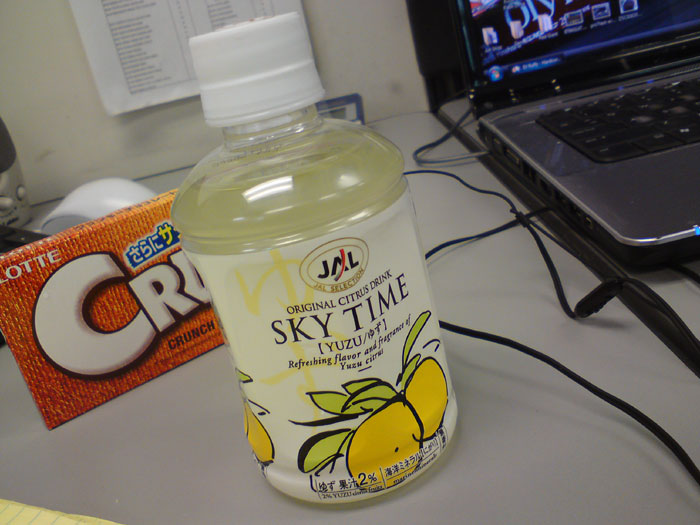
Identify the location of screen. click(577, 15).